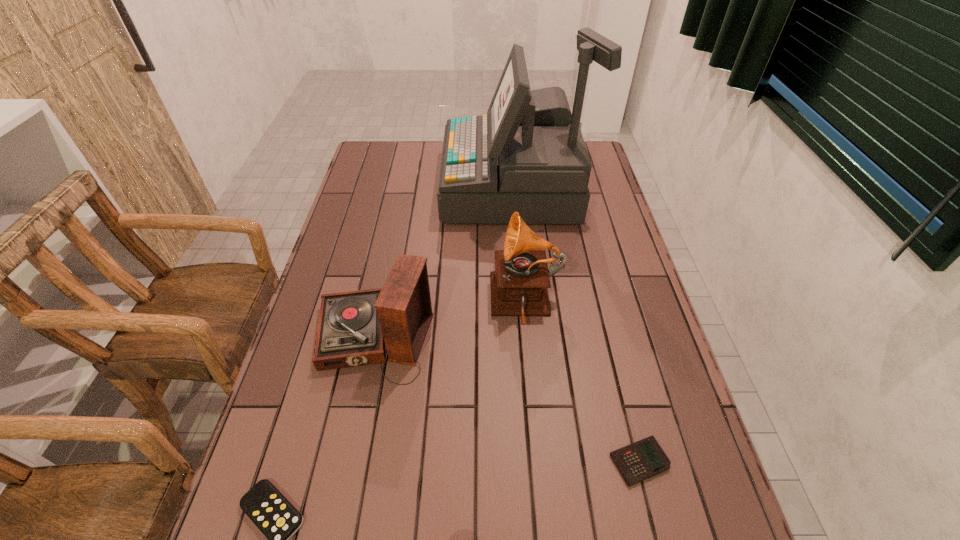
Locate an element on the screen. the tallest object is located at coordinates (527, 155).

Locate an element on the screen. The image size is (960, 540). the farthest object is located at coordinates [x=527, y=155].

Identify the location of the fourth shortest object. (519, 284).

You are a GUI agent. You are given a task and a screenshot of the screen. Output one action in this format:
    pyautogui.click(x=<x>, y=<y>)
    Task: Click on the taller phonograph record
    Image resolution: width=960 pixels, height=540 pixels.
    Given the screenshot: What is the action you would take?
    pyautogui.click(x=519, y=284)

Locate an element on the screen. This screenshot has height=540, width=960. the third shortest object is located at coordinates click(354, 327).

Where is `the left phonograph record`? Image resolution: width=960 pixels, height=540 pixels. the left phonograph record is located at coordinates (354, 327).

In order to click on calculator in this screenshot , I will do `click(641, 460)`.

This screenshot has width=960, height=540. I want to click on blank space located 0.090m on the customer-facing side of the tallest object, so point(419,187).

This screenshot has width=960, height=540. In order to click on free space located on the customer-facing side of the tallest object in this screenshot , I will do `click(408, 187)`.

Identify the location of vacant space located on the customer-facing side of the tallest object. (383, 187).